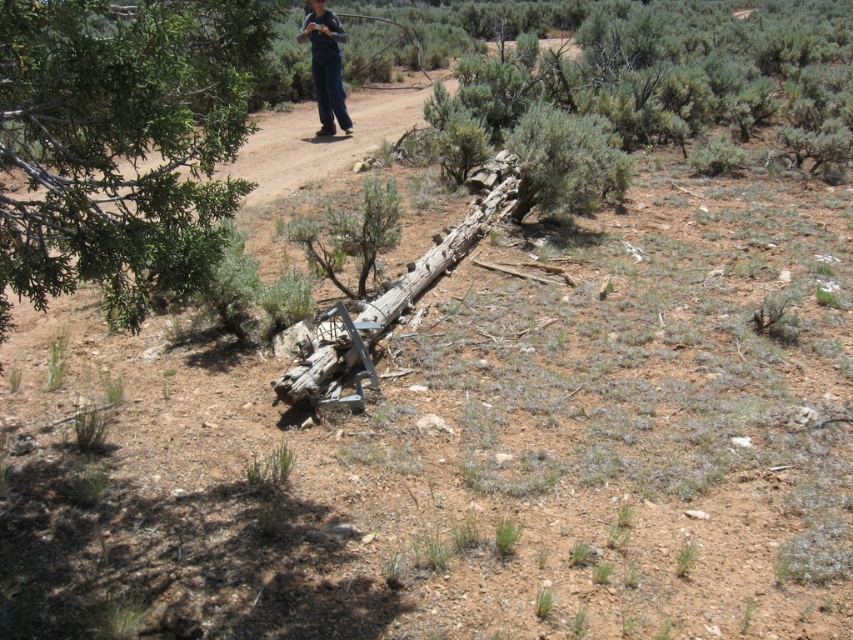
You are a hiker who has just found a water source marked by a green leafy branch at upper left and a dark blue jeans at upper center in the desert. You need to reach the water source quickly. Which object should you head towards first?

Both the green leafy branch at upper left and dark blue jeans at upper center are markers for the water source. Since they are 28.05 feet apart, you can head towards either one as they both indicate the location of the water source.